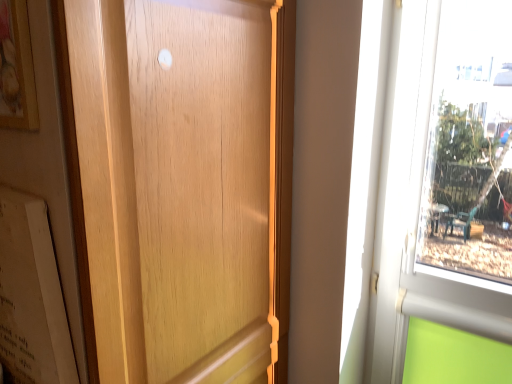
Identify the location of wooden picture frame at upper left. (17, 69).

Does point (164, 305) come in front of point (24, 4)?

No.

Is wooden door at center touching wooden picture frame at upper left?

No, wooden door at center is not next to wooden picture frame at upper left.

In the image, is wooden door at center on the left side or the right side of wooden picture frame at upper left?

wooden door at center is positioned on wooden picture frame at upper left's right side.

Considering the relative sizes of wooden door at center and wooden picture frame at upper left in the image provided, is wooden door at center thinner than wooden picture frame at upper left?

Incorrect, the width of wooden door at center is not less than that of wooden picture frame at upper left.

Are wooden picture frame at upper left and matte white paper at left far apart?

wooden picture frame at upper left is actually quite close to matte white paper at left.

Is wooden picture frame at upper left completely or partially outside of matte white paper at left?

Yes.

Considering the points (28, 113) and (20, 381), which point is behind, point (28, 113) or point (20, 381)?

Positioned behind is point (20, 381).

You are a GUI agent. You are given a task and a screenshot of the screen. Output one action in this format:
    pyautogui.click(x=<x>, y=<y>)
    Task: Click on the picture frame positioned vertically above the matte white paper at left (from a real-world perspective)
    The image size is (512, 384).
    Given the screenshot: What is the action you would take?
    pyautogui.click(x=17, y=69)

Is wooden door at center positioned with its back to matte white paper at left?

No, wooden door at center is not facing the opposite direction of matte white paper at left.

Considering the sizes of objects wooden door at center and matte white paper at left in the image provided, who is thinner, wooden door at center or matte white paper at left?

Thinner between the two is matte white paper at left.

What's the angular difference between wooden door at center and matte white paper at left's facing directions?

They differ by 91.6 degrees in their facing directions.

Does point (161, 165) come in front of point (35, 327)?

No, it is behind (35, 327).

Is matte white paper at left turned away from wooden picture frame at upper left?

No, matte white paper at left is not facing away from wooden picture frame at upper left.

Does matte white paper at left appear on the left side of wooden picture frame at upper left?

Yes, matte white paper at left is to the left of wooden picture frame at upper left.

Does point (41, 287) come farther from viewer compared to point (31, 122)?

Yes, point (41, 287) is behind point (31, 122).

Is matte white paper at left smaller than wooden picture frame at upper left?

Incorrect, matte white paper at left is not smaller in size than wooden picture frame at upper left.

Between wooden picture frame at upper left and wooden door at center, which one has larger size?

With larger size is wooden door at center.

Is point (28, 94) behind point (201, 241)?

No, (28, 94) is in front of (201, 241).

From the picture: Which object is closer to the camera taking this photo, wooden picture frame at upper left or wooden door at center?

wooden door at center is in front.

Considering the sizes of objects wooden picture frame at upper left and wooden door at center in the image provided, who is taller, wooden picture frame at upper left or wooden door at center?

wooden door at center.

The width and height of the screenshot is (512, 384). In the image, there is a matte white paper at left. Find the location of `door below it (from a real-world perspective)`. door below it (from a real-world perspective) is located at coordinates (184, 185).

Is matte white paper at left positioned before wooden door at center?

No, matte white paper at left is further to the viewer.

Looking at this image, is matte white paper at left turned away from wooden door at center?

Yes, matte white paper at left is facing away from wooden door at center.

Identify the location of door that appears below the wooden picture frame at upper left (from a real-world perspective). The height and width of the screenshot is (384, 512). (184, 185).

Image resolution: width=512 pixels, height=384 pixels. Identify the location of picture frame that is above the matte white paper at left (from the image's perspective). (17, 69).

Considering their positions, is wooden door at center positioned further to wooden picture frame at upper left than matte white paper at left?

Among the two, wooden door at center is located further to wooden picture frame at upper left.

When comparing their distances from wooden picture frame at upper left, does matte white paper at left or wooden door at center seem closer?

matte white paper at left is positioned closer to the anchor wooden picture frame at upper left.

Based on their spatial positions, is matte white paper at left or wooden picture frame at upper left closer to wooden door at center?

matte white paper at left.

From the image, which object appears to be nearer to wooden door at center, wooden picture frame at upper left or matte white paper at left?

The object closer to wooden door at center is matte white paper at left.

Consider the image. Estimate the real-world distances between objects in this image. Which object is closer to matte white paper at left, wooden picture frame at upper left or wooden door at center?

wooden door at center.

Which object lies further to the anchor point matte white paper at left, wooden door at center or wooden picture frame at upper left?

Based on the image, wooden picture frame at upper left appears to be further to matte white paper at left.

Locate an element on the screen. This screenshot has width=512, height=384. door between wooden picture frame at upper left and matte white paper at left in the vertical direction is located at coordinates (184, 185).